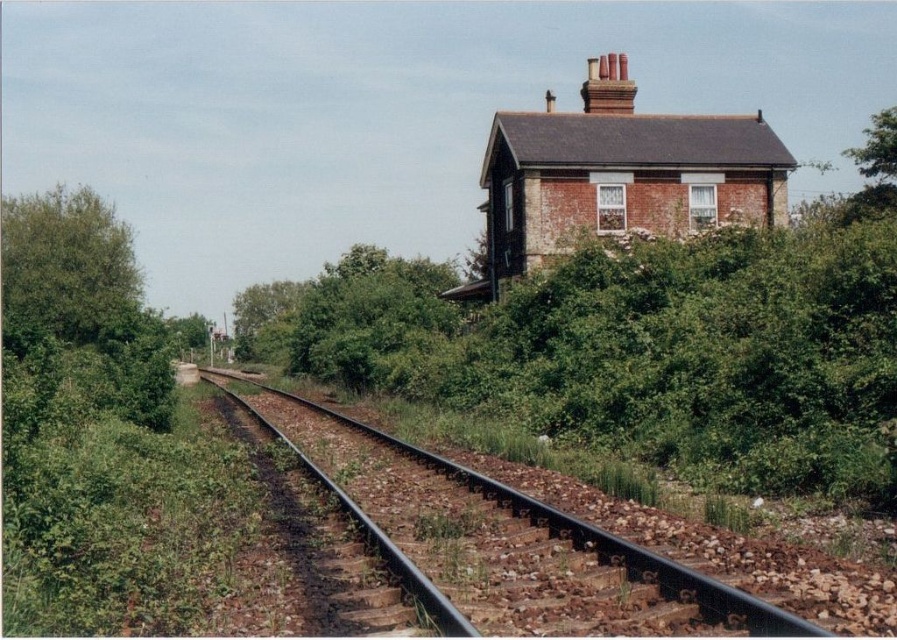
You are a surveyor measuring distances between landmarks in the rural area. You have a measuring tape that can extend up to 40 meters. You need to measure the distance between the green leafy tree at left and the red brick chimney at upper center. Will your measuring tape be sufficient?

The green leafy tree at left is 39.60 meters from the red brick chimney at upper center. Since the measuring tape can extend up to 40 meters, it will be sufficient to measure the distance between them.

You are a hiker standing at the point marked by the coordinates point at point (x=66, y=262). You want to walk towards the small brick building on the right side of the image. Which direction should you head relative to the green leafy tree at left?

The green leafy tree at left is located at point (x=66, y=262). To reach the small brick building on the right side of the image, you should head towards the right direction relative to the green leafy tree at left.